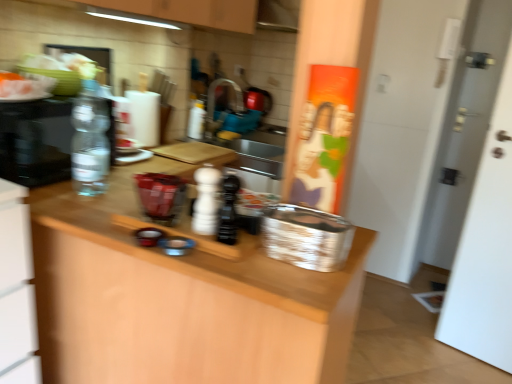
Question: From the image's perspective, relative to white matte pepper shaker at center, arranged as the 2th bottle when viewed from the front, is silver metallic basket at center above or below?

Choices:
 (A) above
 (B) below

Answer: (B)

Question: Is point click(x=296, y=253) positioned closer to the camera than point click(x=203, y=215)?

Choices:
 (A) farther
 (B) closer

Answer: (B)

Question: Which object is positioned farthest from the black matte salt shaker at center, which is the 4th bottle in left-to-right order?

Choices:
 (A) clear glass water bottle at left
 (B) white matte pepper shaker at center, placed as the 3th bottle when sorted from back to front
 (C) translucent plastic bottle at center, which appears as the second bottle when viewed from the left
 (D) silver metallic basket at center
 (E) wooden at center

Answer: (C)

Question: Estimate the real-world distances between objects in this image. Which object is closer to the translucent plastic bottle at center, marked as the 4th bottle in a front-to-back arrangement?

Choices:
 (A) white matte pepper shaker at center, arranged as the 2th bottle when viewed from the front
 (B) silver metallic basket at center
 (C) black matte salt shaker at center, which is the 4th bottle in left-to-right order
 (D) clear glass water bottle at left
 (E) transparent plastic bottle at left, which ranks as the 1th bottle in left-to-right order

Answer: (E)